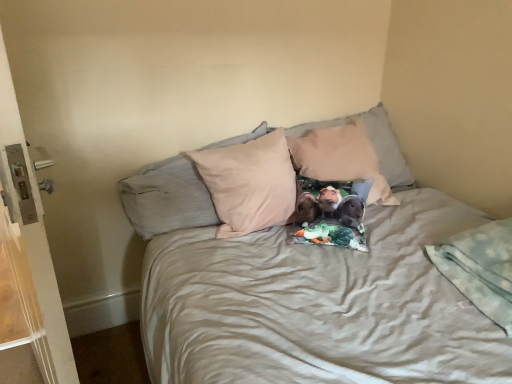
Question: Does beige fabric pillow at center, positioned as the first pillow in left-to-right order, contain beige fabric pillow at center, the first pillow when ordered from right to left?

Choices:
 (A) yes
 (B) no

Answer: (B)

Question: Is beige fabric pillow at center, which appears as the second pillow when viewed from the right, positioned far away from beige fabric pillow at center, the first pillow when ordered from right to left?

Choices:
 (A) no
 (B) yes

Answer: (A)

Question: From a real-world perspective, is beige fabric pillow at center, positioned as the first pillow in left-to-right order, physically above beige fabric pillow at center, the first pillow when ordered from right to left?

Choices:
 (A) no
 (B) yes

Answer: (A)

Question: From the image's perspective, does beige fabric pillow at center, positioned as the first pillow in left-to-right order, appear lower than beige fabric pillow at center, the first pillow when ordered from right to left?

Choices:
 (A) yes
 (B) no

Answer: (A)

Question: Is beige fabric pillow at center, positioned as the first pillow in left-to-right order, positioned in front of beige fabric pillow at center, the first pillow when ordered from right to left?

Choices:
 (A) no
 (B) yes

Answer: (B)

Question: In terms of height, does beige fabric pillow at center, which appears as the second pillow when viewed from the right, look taller or shorter compared to white plastic screen door at left?

Choices:
 (A) tall
 (B) short

Answer: (B)

Question: Visually, is beige fabric pillow at center, positioned as the first pillow in left-to-right order, positioned to the left or to the right of white plastic screen door at left?

Choices:
 (A) right
 (B) left

Answer: (A)

Question: From a real-world perspective, is beige fabric pillow at center, which appears as the second pillow when viewed from the right, positioned above or below white plastic screen door at left?

Choices:
 (A) above
 (B) below

Answer: (A)

Question: Considering the positions of beige fabric pillow at center, positioned as the first pillow in left-to-right order, and white plastic screen door at left in the image, is beige fabric pillow at center, positioned as the first pillow in left-to-right order, bigger or smaller than white plastic screen door at left?

Choices:
 (A) small
 (B) big

Answer: (A)

Question: In the image, is beige fabric pillow at center, the first pillow when ordered from right to left, positioned in front of or behind beige fabric pillow at center, which appears as the second pillow when viewed from the right?

Choices:
 (A) front
 (B) behind

Answer: (B)

Question: Is beige fabric pillow at center, the 2th pillow from the left, wider or thinner than beige fabric pillow at center, positioned as the first pillow in left-to-right order?

Choices:
 (A) wide
 (B) thin

Answer: (B)

Question: Would you say beige fabric pillow at center, the first pillow when ordered from right to left, is inside or outside beige fabric pillow at center, which appears as the second pillow when viewed from the right?

Choices:
 (A) inside
 (B) outside

Answer: (B)

Question: Based on their positions, is beige fabric pillow at center, the first pillow when ordered from right to left, located to the left or right of beige fabric pillow at center, which appears as the second pillow when viewed from the right?

Choices:
 (A) right
 (B) left

Answer: (A)

Question: From the image's perspective, is white plastic screen door at left above or below beige fabric pillow at center, positioned as the first pillow in left-to-right order?

Choices:
 (A) below
 (B) above

Answer: (A)

Question: Considering the relative positions of white plastic screen door at left and beige fabric pillow at center, which appears as the second pillow when viewed from the right, in the image provided, is white plastic screen door at left to the left or to the right of beige fabric pillow at center, which appears as the second pillow when viewed from the right,?

Choices:
 (A) left
 (B) right

Answer: (A)